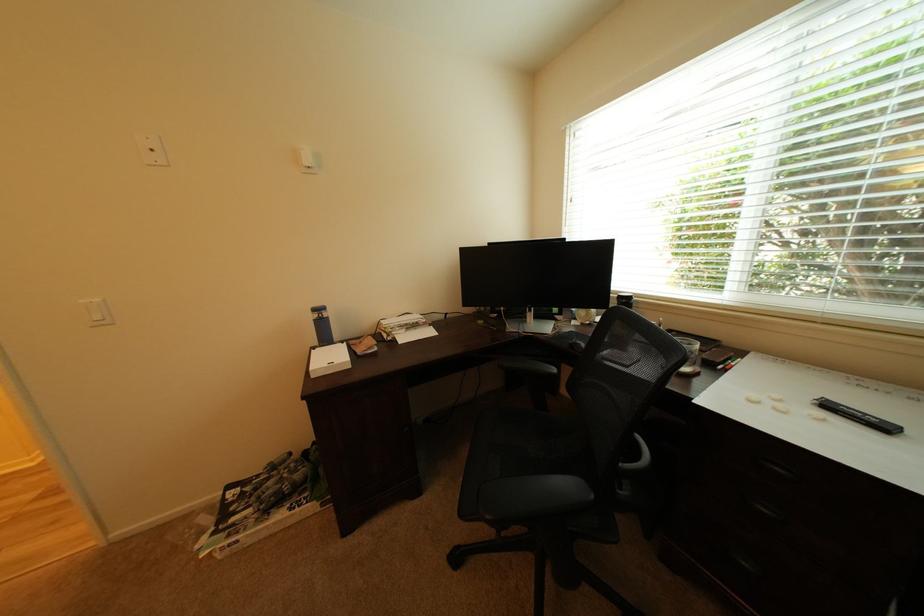
Where would you lift the blue water bottle? Please return your answer as a coordinate pair (x, y).

(322, 325)